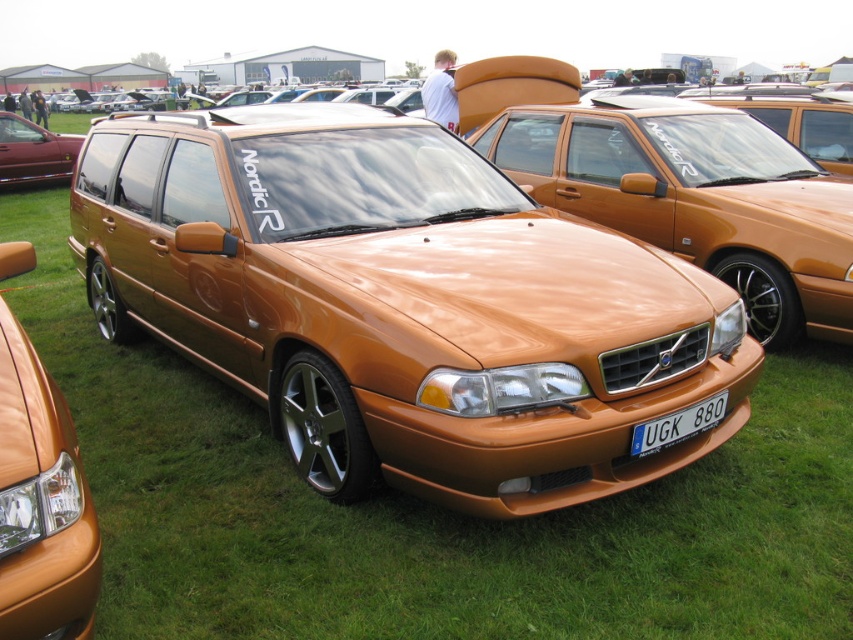
You are a photographer planning to take a photo of the matte orange sedan at center and the metallic red sedan at left. Which car should you focus on first if you want to capture both in a single frame without moving the camera? Explain your reasoning based on their sizes and positions.

The matte orange sedan at center is smaller than the metallic red sedan at left. To capture both in a single frame without moving the camera, focus on the metallic red sedan at left first since it is larger and might require more framing adjustments to ensure it fits properly, allowing the smaller matte orange sedan at center to naturally fit into the composition.

You are a photographer at the car show and want to capture both the metallic red sedan at left and the white plastic license plate at center in a single shot. Which object should you position closer to the left side of your camera frame?

You should position the metallic red sedan at left closer to the left side of your camera frame since it is already to the left of the white plastic license plate at center.